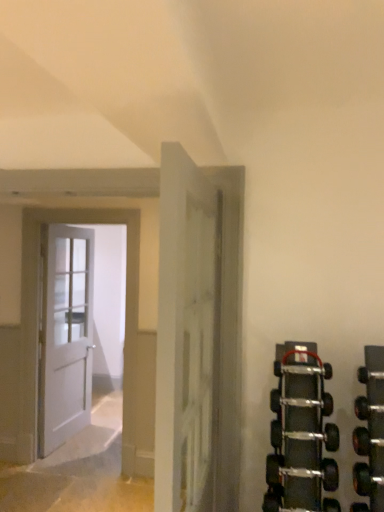
Question: Is white matte door at center, the 3th door in the left-to-right sequence, oriented towards white matte door at left, placed as the 1th door when sorted from back to front?

Choices:
 (A) no
 (B) yes

Answer: (A)

Question: Would you say white matte door at center, which ranks as the first door in front-to-back order, is outside white matte door at left, the 3th door when ordered from front to back?

Choices:
 (A) no
 (B) yes

Answer: (B)

Question: Is white matte door at center, which ranks as the first door in front-to-back order, surrounding white matte door at left, the first door positioned from the left?

Choices:
 (A) yes
 (B) no

Answer: (B)

Question: Considering the relative sizes of white matte door at center, the 3th door in the left-to-right sequence, and white matte door at left, the first door positioned from the left, in the image provided, is white matte door at center, the 3th door in the left-to-right sequence, bigger than white matte door at left, the first door positioned from the left,?

Choices:
 (A) no
 (B) yes

Answer: (A)

Question: Does white matte door at center, the 3th door from the back, have a lesser width compared to white matte door at left, the first door positioned from the left?

Choices:
 (A) yes
 (B) no

Answer: (A)

Question: From a real-world perspective, is white matte door at left, the third door when ordered from right to left, physically located above or below white matte door at center, which ranks as the first door in front-to-back order?

Choices:
 (A) above
 (B) below

Answer: (B)

Question: In terms of size, does white matte door at left, placed as the 1th door when sorted from back to front, appear bigger or smaller than white matte door at center, the 1th door viewed from the right?

Choices:
 (A) small
 (B) big

Answer: (B)

Question: Is white matte door at left, placed as the 1th door when sorted from back to front, inside or outside of white matte door at center, the 3th door in the left-to-right sequence?

Choices:
 (A) inside
 (B) outside

Answer: (B)

Question: Considering the positions of white matte door at left, placed as the 1th door when sorted from back to front, and white matte door at center, which ranks as the first door in front-to-back order, in the image, is white matte door at left, placed as the 1th door when sorted from back to front, taller or shorter than white matte door at center, which ranks as the first door in front-to-back order,?

Choices:
 (A) short
 (B) tall

Answer: (B)

Question: Based on their positions, is white wooden door at left, the 2th door from the left, located to the left or right of white matte door at center, the 3th door in the left-to-right sequence?

Choices:
 (A) right
 (B) left

Answer: (B)

Question: Is white wooden door at left, marked as the 2th door in a front-to-back arrangement, taller or shorter than white matte door at center, which ranks as the first door in front-to-back order?

Choices:
 (A) short
 (B) tall

Answer: (B)

Question: Does point (46, 216) appear closer or farther from the camera than point (185, 356)?

Choices:
 (A) closer
 (B) farther

Answer: (B)

Question: In terms of width, does white wooden door at left, the 2th door from the left, look wider or thinner when compared to white matte door at center, the 1th door viewed from the right?

Choices:
 (A) thin
 (B) wide

Answer: (A)

Question: Is point (114, 210) closer or farther from the camera than point (81, 323)?

Choices:
 (A) closer
 (B) farther

Answer: (A)

Question: From the image's perspective, is white wooden door at left, the second door from the back, located above or below white matte door at left, the first door positioned from the left?

Choices:
 (A) above
 (B) below

Answer: (A)